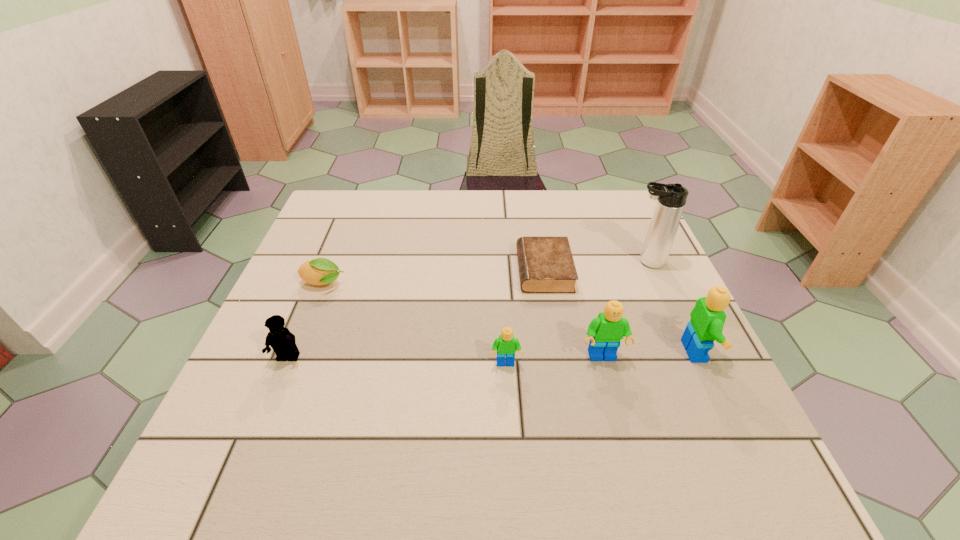
The image size is (960, 540). I want to click on thermos bottle present at the right edge, so click(671, 198).

Locate an element on the screen. vacant space at the far edge is located at coordinates (453, 196).

You are a GUI agent. You are given a task and a screenshot of the screen. Output one action in this format:
    pyautogui.click(x=<x>, y=<y>)
    Task: Click on the free space at the near edge of the desktop
    
    Given the screenshot: What is the action you would take?
    pyautogui.click(x=380, y=422)

Identify the location of vacant space at the left edge of the desktop. Image resolution: width=960 pixels, height=540 pixels. (300, 389).

Find the location of a particular element. The height and width of the screenshot is (540, 960). vacant space at the right edge is located at coordinates (652, 291).

The height and width of the screenshot is (540, 960). I want to click on vacant space at the far right corner of the desktop, so click(x=640, y=223).

This screenshot has width=960, height=540. What are the coordinates of `vacant space at the near right corner` in the screenshot? It's located at (728, 409).

At what (x,y) coordinates should I click in order to perform the action: click on vacant point located between the second Lego from left to right and the third tallest object. Please return your answer as a coordinate pair (x, y). Looking at the image, I should click on (554, 361).

Identify the location of vacant space that is in between the shortest object and the third Lego from left to right. This screenshot has width=960, height=540. (x=573, y=314).

Where is `vacant point located between the rightmost Lego and the third shortest Lego`? The width and height of the screenshot is (960, 540). vacant point located between the rightmost Lego and the third shortest Lego is located at coordinates (650, 354).